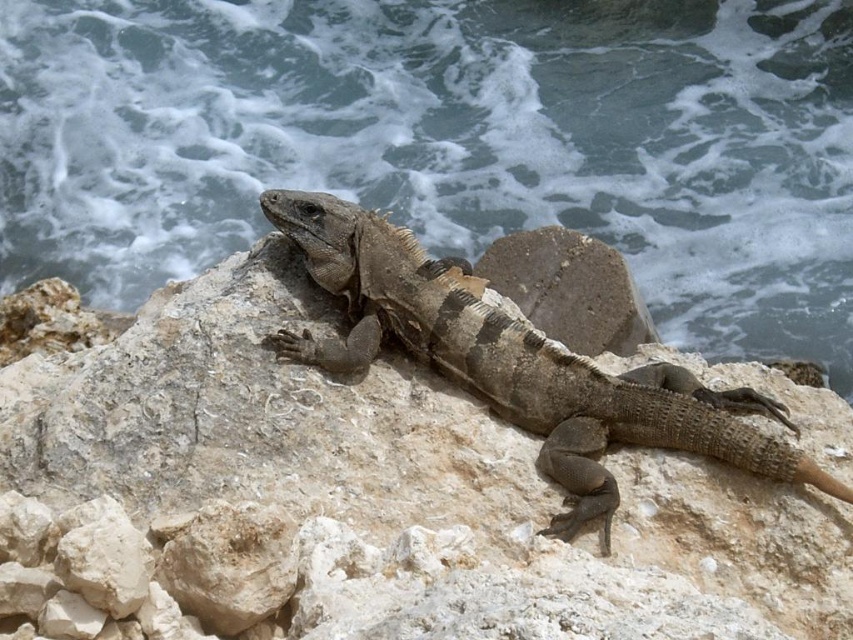
Question: Can you confirm if blue-green water at upper center is positioned below brown scaly lizard at center?

Choices:
 (A) no
 (B) yes

Answer: (A)

Question: Does blue-green water at upper center appear over brown scaly lizard at center?

Choices:
 (A) no
 (B) yes

Answer: (B)

Question: Does blue-green water at upper center appear over brown scaly lizard at center?

Choices:
 (A) no
 (B) yes

Answer: (B)